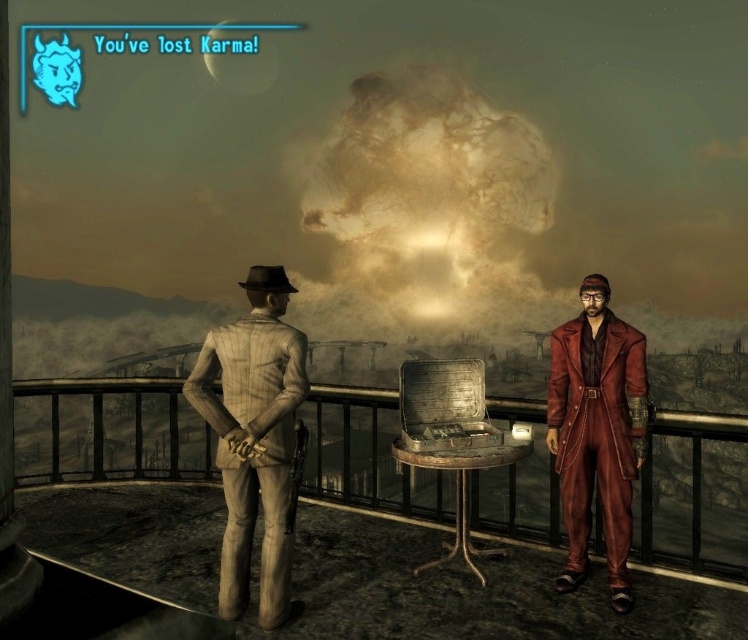
Between light brown striped suit at left and leather coat at right, which one is positioned lower?

leather coat at right is below.

Is point (260, 408) more distant than point (589, 369)?

No.

The height and width of the screenshot is (640, 748). What are the coordinates of `light brown striped suit at left` in the screenshot? It's located at (254, 438).